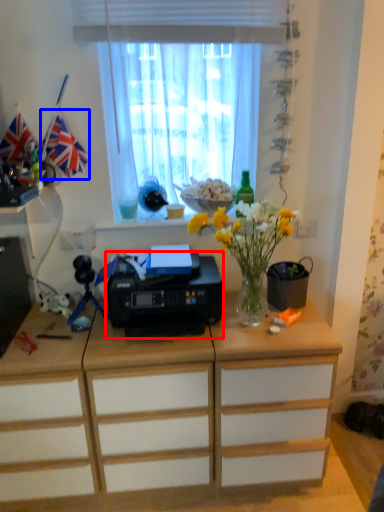
Question: Which of the following is the farthest to the observer, printer (highlighted by a red box) or flag (highlighted by a blue box)?

Choices:
 (A) printer
 (B) flag

Answer: (B)